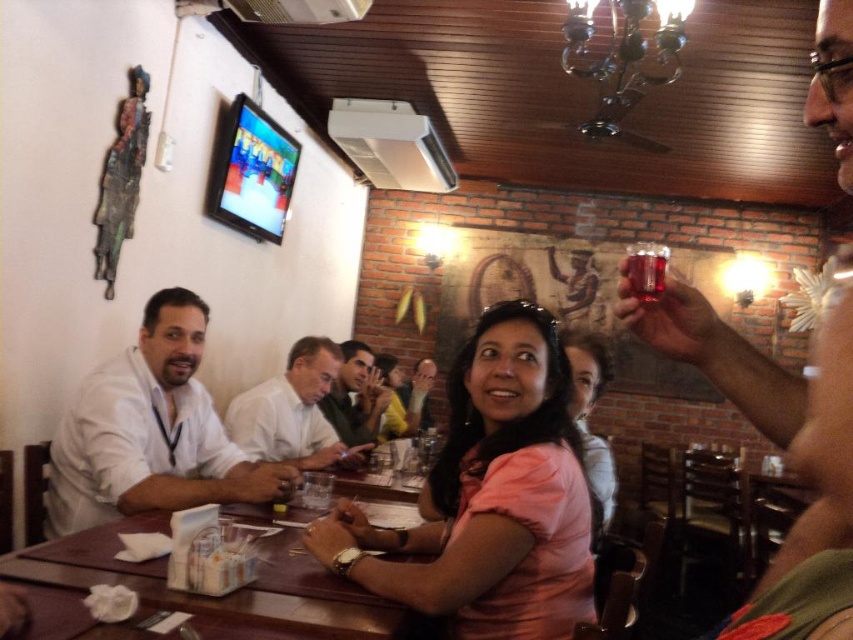
Question: Which point is closer to the camera?

Choices:
 (A) (219, 445)
 (B) (297, 344)
 (C) (328, 406)

Answer: (A)

Question: Is white matte shirt at left positioned in front of brown wooden table at center?

Choices:
 (A) no
 (B) yes

Answer: (A)

Question: Is pink matte shirt at center to the left of white matte shirt at left from the viewer's perspective?

Choices:
 (A) no
 (B) yes

Answer: (A)

Question: Which point is farther from the camera taking this photo?

Choices:
 (A) (756, 406)
 (B) (202, 497)
 (C) (339, 406)
 (D) (410, 381)

Answer: (D)

Question: Is shiny metallic cup at upper right positioned before smooth white shirt at center?

Choices:
 (A) yes
 (B) no

Answer: (A)

Question: Which of the following is the farthest from the observer?

Choices:
 (A) translucent glass at upper center
 (B) pink matte shirt at center
 (C) smooth white shirt at center
 (D) light brown leather shirt at center

Answer: (C)